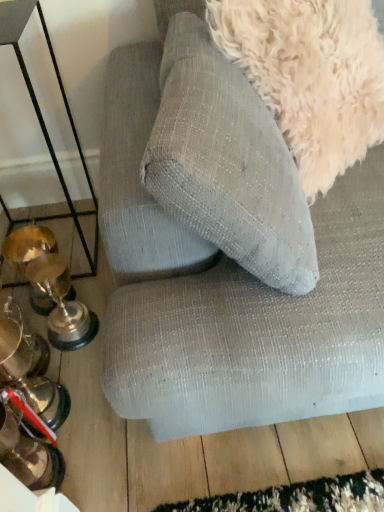
Question: Is point (332, 313) positioned closer to the camera than point (261, 52)?

Choices:
 (A) farther
 (B) closer

Answer: (B)

Question: Based on their positions, is textured fabric couch at upper center located to the left or right of fuzzy white dog at upper right?

Choices:
 (A) left
 (B) right

Answer: (B)

Question: Which is nearer to the fuzzy white dog at upper right?

Choices:
 (A) textured fabric couch at upper center
 (B) metallic trophies at left

Answer: (A)

Question: Based on their relative distances, which object is nearer to the textured fabric couch at upper center?

Choices:
 (A) fuzzy white dog at upper right
 (B) metallic trophies at left

Answer: (A)